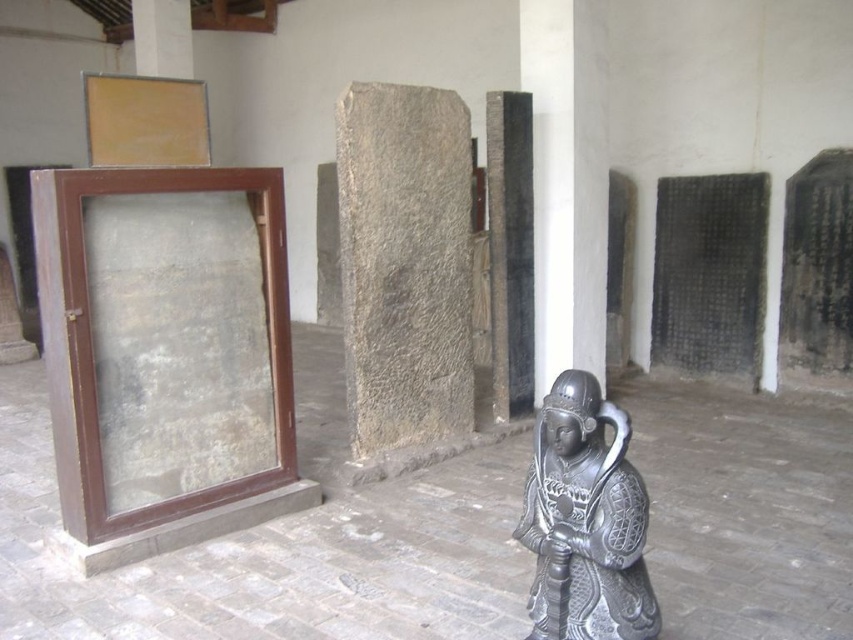
You are an architect visiting the exhibit and need to determine the spatial relationship between the gray stone pillar at center and the white stone pillar at upper left. Which pillar occupies more space in the image?

The gray stone pillar at center is bigger than the white stone pillar at upper left, so it occupies more space in the image.

You are an architect designing a new exhibit layout and need to place a 3D model of a dragon statue that requires a base at least 2 meters tall. Given the scene, which object between the black polished stone pillar at center and the white stone pillar at upper left would be suitable for placing the dragon statue model?

The black polished stone pillar at center has a greater height compared to the white stone pillar at upper left, so it would be suitable for placing the dragon statue model as it meets the minimum height requirement of 2 meters.